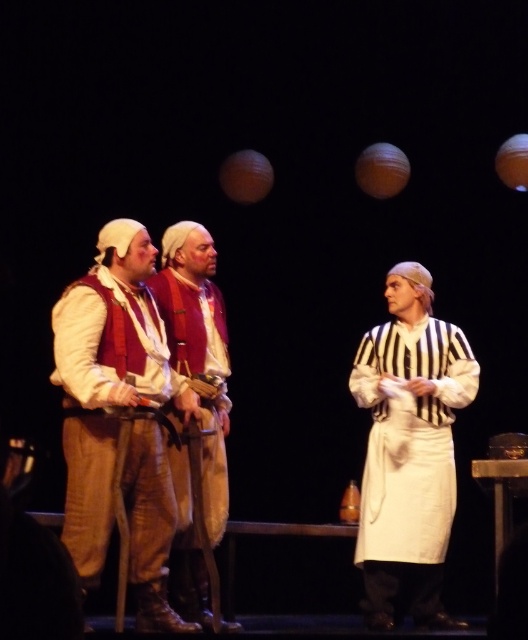
You are an audience member sitting in the front row of the theater. You notice the white striped shirt at right and the matte red vest at center. Which one do you see closer to the front of the stage?

The white striped shirt at right is closer to the front of the stage because the matte red vest at center is behind it.

You are an audience member sitting in the front row of the theater. You notice two characters on stage, the white striped shirt at right and the matte brown vest at center. Which character is closer to you?

The white striped shirt at right is closer to you because it is further to the viewer than the matte brown vest at center.

From the picture: You are a stagehand preparing to adjust the lighting for the scene. You need to ensure that the spotlight can cover both the white striped shirt at right and the matte red vest at center. Given that the spotlight can only cover objects up to the size of the larger of the two, which object determines the minimum required spotlight size?

The white striped shirt at right has a larger width than the matte red vest at center, so the spotlight must be at least as large as the white striped shirt at right to cover both.